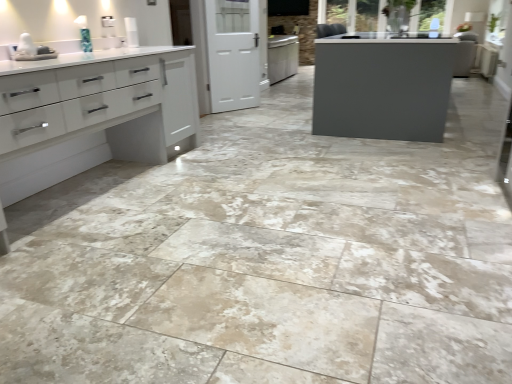
This screenshot has height=384, width=512. In order to click on white glossy cabinet at left in this screenshot , I will do click(106, 107).

Locate an element on the screen. Image resolution: width=512 pixels, height=384 pixels. white glossy sink at upper left is located at coordinates (31, 50).

Identify the location of white glossy cabinet at left. (106, 107).

From the picture: Considering the relative positions of white glossy cabinet at left and white matte screen door at center in the image provided, is white glossy cabinet at left to the right of white matte screen door at center from the viewer's perspective?

No.

Considering the relative sizes of white glossy cabinet at left and white matte screen door at center in the image provided, is white glossy cabinet at left thinner than white matte screen door at center?

No, white glossy cabinet at left is not thinner than white matte screen door at center.

What's the angular difference between white glossy cabinet at left and white matte screen door at center's facing directions?

The angle between the facing direction of white glossy cabinet at left and the facing direction of white matte screen door at center is 32.5 degrees.

You are a GUI agent. You are given a task and a screenshot of the screen. Output one action in this format:
    pyautogui.click(x=<x>, y=<y>)
    Task: Click on the screen door that is above the white glossy cabinet at left (from a real-world perspective)
    The image size is (512, 384).
    Given the screenshot: What is the action you would take?
    pyautogui.click(x=233, y=54)

Who is shorter, white matte screen door at center or white glossy cabinet at left?

white glossy cabinet at left.

Is point (258, 18) farther from camera compared to point (15, 76)?

That is True.

Is white glossy cabinet at left at the back of white matte screen door at center?

That's not correct — white matte screen door at center is not looking away from white glossy cabinet at left.

From a real-world perspective, is white matte screen door at center below white glossy cabinet at left?

No.

Is white glossy sink at upper left positioned in front of white glossy cabinet at left?

No, it is not.

The image size is (512, 384). I want to click on cupboard that is on the right side of white glossy sink at upper left, so click(x=106, y=107).

Is point (33, 48) less distant than point (183, 90)?

That is True.

Is white glossy cabinet at left completely or partially inside white glossy sink at upper left?

Actually, white glossy cabinet at left is outside white glossy sink at upper left.

From a real-world perspective, is white glossy sink at upper left under white matte screen door at center?

No.

Is white glossy sink at upper left next to white matte screen door at center and touching it?

white glossy sink at upper left and white matte screen door at center are not in contact.

Can you tell me how much white glossy sink at upper left and white matte screen door at center differ in facing direction?

There is a 31.9-degree angle between the facing directions of white glossy sink at upper left and white matte screen door at center.

Is point (23, 37) positioned before point (259, 101)?

That is True.

Where is `sink behind the white glossy cabinet at left`? The image size is (512, 384). sink behind the white glossy cabinet at left is located at coordinates (31, 50).

Is white glossy sink at upper left at the back of white glossy cabinet at left?

white glossy cabinet at left is not turned away from white glossy sink at upper left.

Between white glossy cabinet at left and white glossy sink at upper left, which one has more height?

white glossy cabinet at left.

Is white glossy cabinet at left beside white glossy sink at upper left?

No, white glossy cabinet at left is not in contact with white glossy sink at upper left.

From the image's perspective, is white matte screen door at center below white glossy sink at upper left?

Incorrect, from the image's perspective, white matte screen door at center is higher than white glossy sink at upper left.

Is white matte screen door at center smaller than white glossy sink at upper left?

No, white matte screen door at center is not smaller than white glossy sink at upper left.

From a real-world perspective, is white matte screen door at center positioned above or below white glossy sink at upper left?

In terms of real-world spatial position, white matte screen door at center is below white glossy sink at upper left.

Which is closer to the camera, (x=230, y=3) or (x=44, y=45)?

The point (x=44, y=45) is closer to the camera.

The image size is (512, 384). There is a white glossy cabinet at left. Identify the location of screen door above it (from a real-world perspective). (233, 54).

Find the location of a particular element. This screenshot has height=384, width=512. screen door behind the white glossy cabinet at left is located at coordinates (233, 54).

Based on their spatial positions, is white glossy cabinet at left or white matte screen door at center further from white glossy sink at upper left?

white matte screen door at center is positioned further to the anchor white glossy sink at upper left.

Considering their positions, is white matte screen door at center positioned closer to white glossy sink at upper left than white glossy cabinet at left?

Among the two, white glossy cabinet at left is located nearer to white glossy sink at upper left.

When comparing their distances from white glossy cabinet at left, does white glossy sink at upper left or white matte screen door at center seem closer?

Based on the image, white glossy sink at upper left appears to be nearer to white glossy cabinet at left.

Estimate the real-world distances between objects in this image. Which object is further from white matte screen door at center, white glossy sink at upper left or white glossy cabinet at left?

Among the two, white glossy sink at upper left is located further to white matte screen door at center.

From the image, which object appears to be farther from white glossy cabinet at left, white matte screen door at center or white glossy sink at upper left?

white matte screen door at center.

Based on their spatial positions, is white glossy cabinet at left or white glossy sink at upper left further from white matte screen door at center?

white glossy sink at upper left lies further to white matte screen door at center than the other object.

Identify the location of sink positioned between white glossy cabinet at left and white matte screen door at center from near to far. The image size is (512, 384). (31, 50).